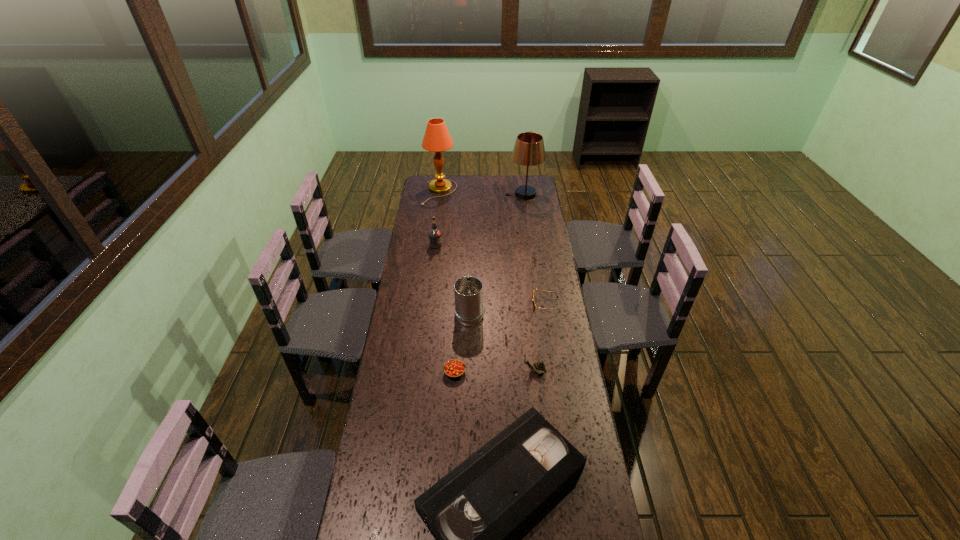
Where is `object at the far right corner`? object at the far right corner is located at coordinates (529, 150).

The width and height of the screenshot is (960, 540). What are the coordinates of `blank space at the far edge` in the screenshot? It's located at (468, 181).

Image resolution: width=960 pixels, height=540 pixels. What are the coordinates of `vacant space at the left edge of the desktop` in the screenshot? It's located at (405, 314).

You are a GUI agent. You are given a task and a screenshot of the screen. Output one action in this format:
    pyautogui.click(x=<x>, y=<y>)
    Task: Click on the vacant area at the right edge of the desktop
    
    Given the screenshot: What is the action you would take?
    pyautogui.click(x=517, y=211)

Find the location of a particular element. The width and height of the screenshot is (960, 540). vacant area at the far right corner of the desktop is located at coordinates (518, 183).

Locate an element on the screen. free point between the strawberry and the lamp is located at coordinates (447, 282).

Where is `free space between the lamp and the strawberry`? The width and height of the screenshot is (960, 540). free space between the lamp and the strawberry is located at coordinates (447, 282).

You are a GUI agent. You are given a task and a screenshot of the screen. Output one action in this format:
    pyautogui.click(x=<x>, y=<y>)
    Task: Click on the empty location between the lamp and the shortest object
    The width and height of the screenshot is (960, 540).
    Given the screenshot: What is the action you would take?
    pyautogui.click(x=492, y=248)

Identify the location of empty location between the strawberry and the mug. The width and height of the screenshot is (960, 540). click(x=462, y=341).

I want to click on empty location between the third farthest object and the fifth tallest object, so click(485, 308).